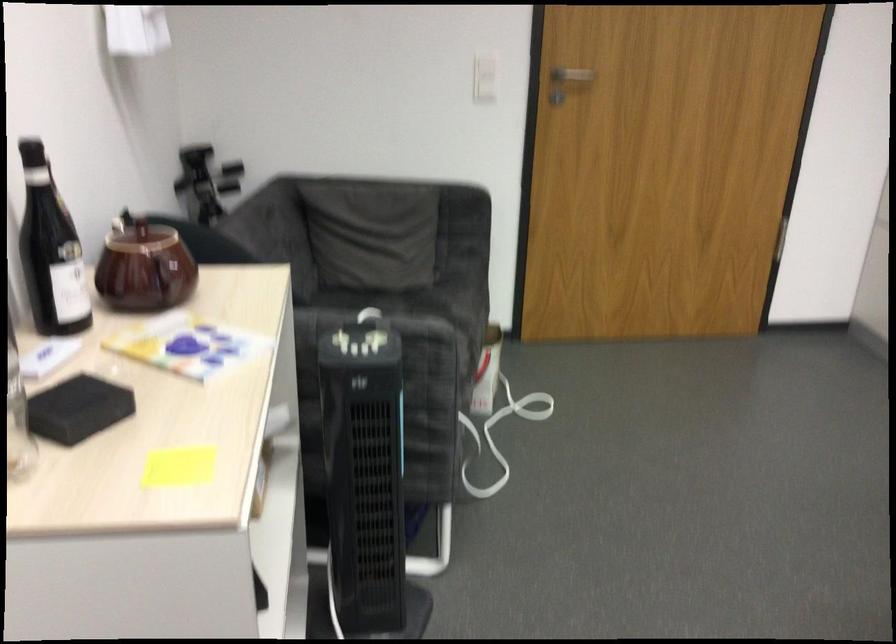
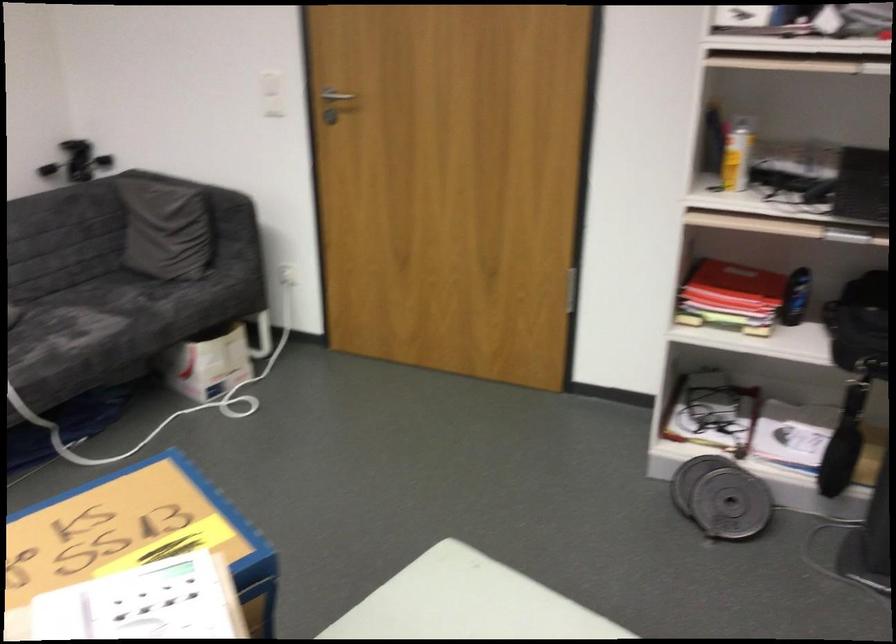
Question: In a continuous first-person perspective shot, in which direction is the camera moving?

Choices:
 (A) Left
 (B) Right
 (C) Forward
 (D) Backward

Answer: (B)